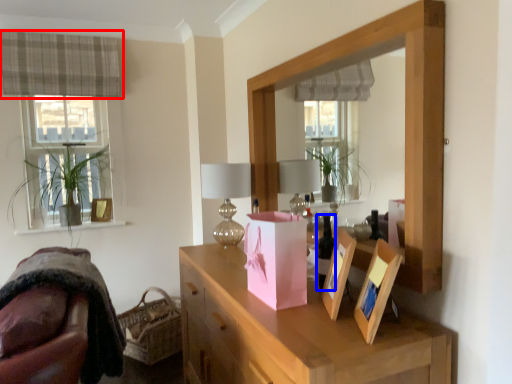
Question: Which point is closer to the camera, curtain (highlighted by a red box) or wine bottle (highlighted by a blue box)?

Choices:
 (A) curtain
 (B) wine bottle

Answer: (B)